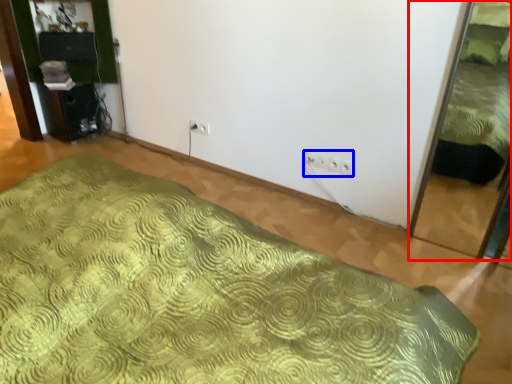
Question: Which object appears closest to the camera in this image, bed (highlighted by a red box) or electric outlet (highlighted by a blue box)?

Choices:
 (A) bed
 (B) electric outlet

Answer: (A)